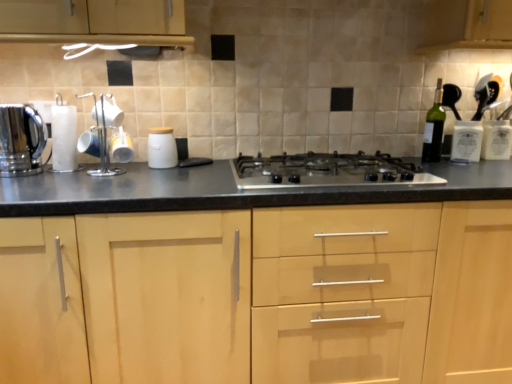
What are the coordinates of `free space to the right of green glass bottle at right` in the screenshot? It's located at (467, 162).